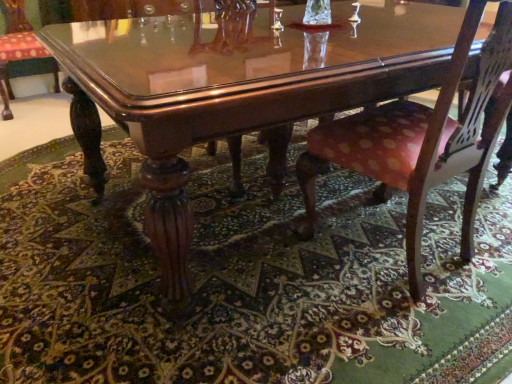
Question: Can you confirm if green patterned rug at lower center is wider than glossy wood coffee table at center?

Choices:
 (A) yes
 (B) no

Answer: (A)

Question: Is green patterned rug at lower center turned away from glossy wood coffee table at center?

Choices:
 (A) yes
 (B) no

Answer: (B)

Question: Is green patterned rug at lower center smaller than glossy wood coffee table at center?

Choices:
 (A) no
 (B) yes

Answer: (B)

Question: Is green patterned rug at lower center positioned beyond the bounds of glossy wood coffee table at center?

Choices:
 (A) yes
 (B) no

Answer: (A)

Question: Considering the relative sizes of green patterned rug at lower center and glossy wood coffee table at center in the image provided, is green patterned rug at lower center thinner than glossy wood coffee table at center?

Choices:
 (A) no
 (B) yes

Answer: (A)

Question: Looking at the image, does green patterned rug at lower center seem bigger or smaller compared to glossy wood coffee table at center?

Choices:
 (A) big
 (B) small

Answer: (B)

Question: From a real-world perspective, is green patterned rug at lower center above or below glossy wood coffee table at center?

Choices:
 (A) below
 (B) above

Answer: (A)

Question: From their relative heights in the image, would you say green patterned rug at lower center is taller or shorter than glossy wood coffee table at center?

Choices:
 (A) short
 (B) tall

Answer: (A)

Question: Is green patterned rug at lower center spatially inside glossy wood coffee table at center, or outside of it?

Choices:
 (A) outside
 (B) inside

Answer: (A)

Question: Is point (490, 228) positioned closer to the camera than point (482, 44)?

Choices:
 (A) farther
 (B) closer

Answer: (A)

Question: From a real-world perspective, is green patterned rug at lower center above or below polka dot fabric chair at lower right, marked as the 1th chair in a bottom-to-top arrangement?

Choices:
 (A) above
 (B) below

Answer: (B)

Question: Considering the positions of green patterned rug at lower center and polka dot fabric chair at lower right, the second chair from the back, in the image, is green patterned rug at lower center bigger or smaller than polka dot fabric chair at lower right, the second chair from the back,?

Choices:
 (A) big
 (B) small

Answer: (A)

Question: Considering the positions of green patterned rug at lower center and polka dot fabric chair at lower right, the second chair from the back, in the image, is green patterned rug at lower center wider or thinner than polka dot fabric chair at lower right, the second chair from the back,?

Choices:
 (A) wide
 (B) thin

Answer: (A)

Question: From a real-world perspective, is green patterned rug at lower center physically located above or below polished wood chair at lower left, the first chair in the back-to-front sequence?

Choices:
 (A) below
 (B) above

Answer: (A)

Question: Based on their positions, is green patterned rug at lower center located to the left or right of polished wood chair at lower left, the first chair in the back-to-front sequence?

Choices:
 (A) right
 (B) left

Answer: (A)